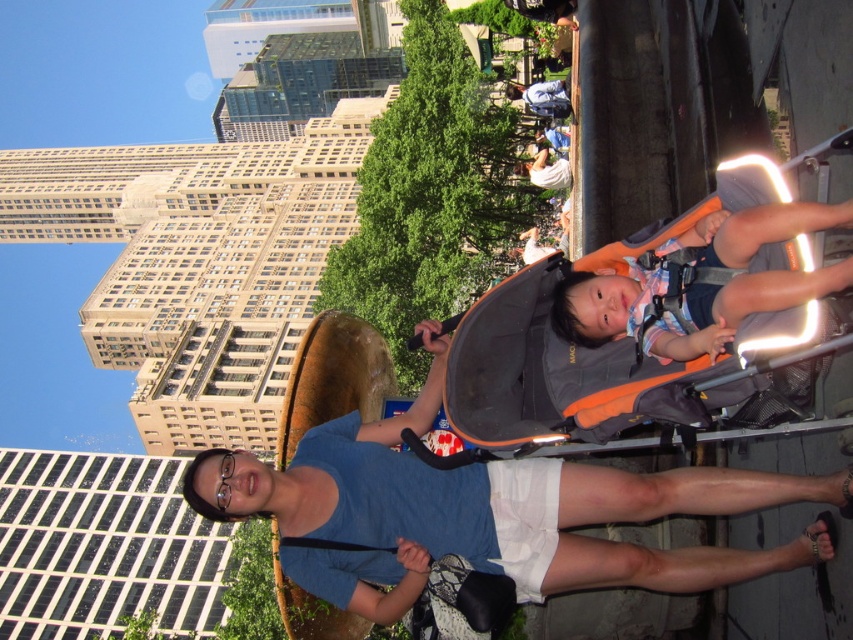
You are a photographer trying to capture the person in the blue fabric shirt at center. The camera is set to focus on the point at coordinates (488, 513). Will the focus point successfully capture the person?

The point (488, 513) indicates blue fabric shirt at center, so yes, the focus point will successfully capture the person in the blue fabric shirt at center.

You are a photographer trying to capture a photo of the blue fabric shirt at center and the orange fabric baby carriage at center. If you want to ensure both objects are in focus, which one should you adjust your camera focus on first considering their sizes?

The blue fabric shirt at center has a larger width than the orange fabric baby carriage at center, so you should focus on the blue fabric shirt at center first to ensure both are in focus.